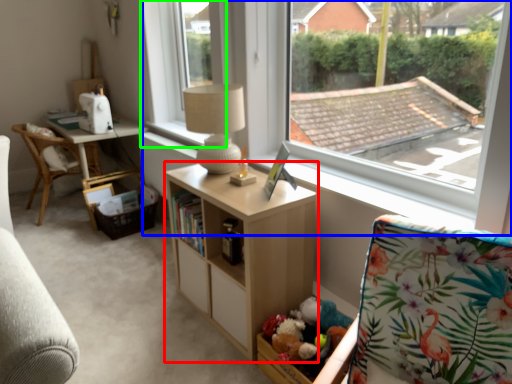
Question: Considering the real-world distances, which object is closest to shelf (highlighted by a red box)? window (highlighted by a blue box) or window frame (highlighted by a green box).

Choices:
 (A) window
 (B) window frame

Answer: (A)